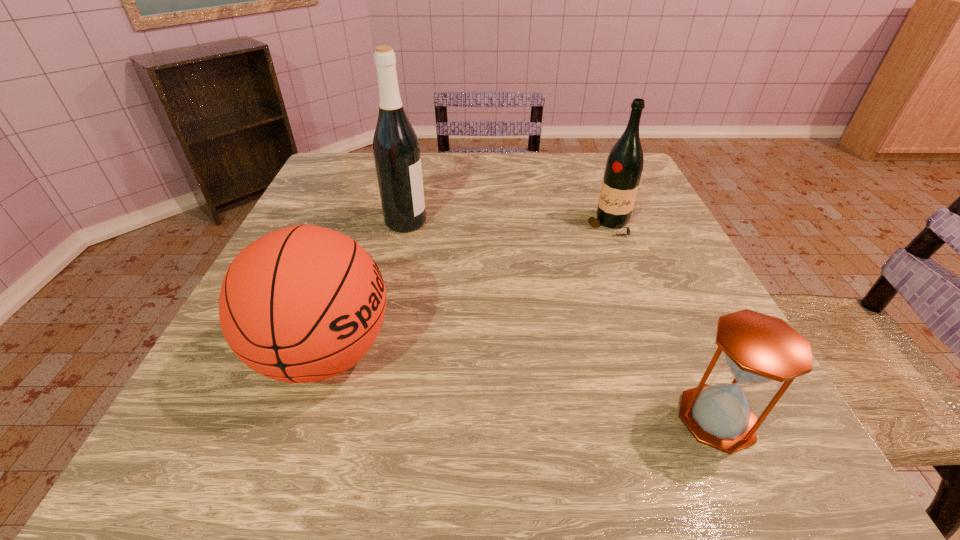
The height and width of the screenshot is (540, 960). I want to click on blank space at the near left corner of the desktop, so click(x=231, y=458).

You are a GUI agent. You are given a task and a screenshot of the screen. Output one action in this format:
    pyautogui.click(x=<x>, y=<y>)
    Task: Click on the unoccupied position between the basketball and the shortest object
    This screenshot has width=960, height=540.
    Given the screenshot: What is the action you would take?
    pyautogui.click(x=520, y=386)

This screenshot has height=540, width=960. What are the coordinates of `empty space between the shorter wine bottle and the second shortest object` in the screenshot? It's located at (467, 289).

Locate an element on the screen. free space between the basketball and the shorter wine bottle is located at coordinates pos(467,289).

Where is `free space between the hourglass and the third tallest object`? The image size is (960, 540). free space between the hourglass and the third tallest object is located at coordinates (520, 386).

Where is `free space between the third shortest object and the hourglass`? free space between the third shortest object and the hourglass is located at coordinates (662, 322).

Locate an element on the screen. vacant point located between the right wine bottle and the hourglass is located at coordinates (662, 322).

Identify the location of vacant space that is in between the basketball and the second tallest object. (467, 289).

At what (x,y) coordinates should I click in order to perform the action: click on object that is the third nearest to the hourglass. Please return your answer as a coordinate pair (x, y). This screenshot has height=540, width=960. Looking at the image, I should click on (396, 150).

This screenshot has height=540, width=960. Find the location of `object that stands as the third closest to the hourglass`. object that stands as the third closest to the hourglass is located at coordinates (396, 150).